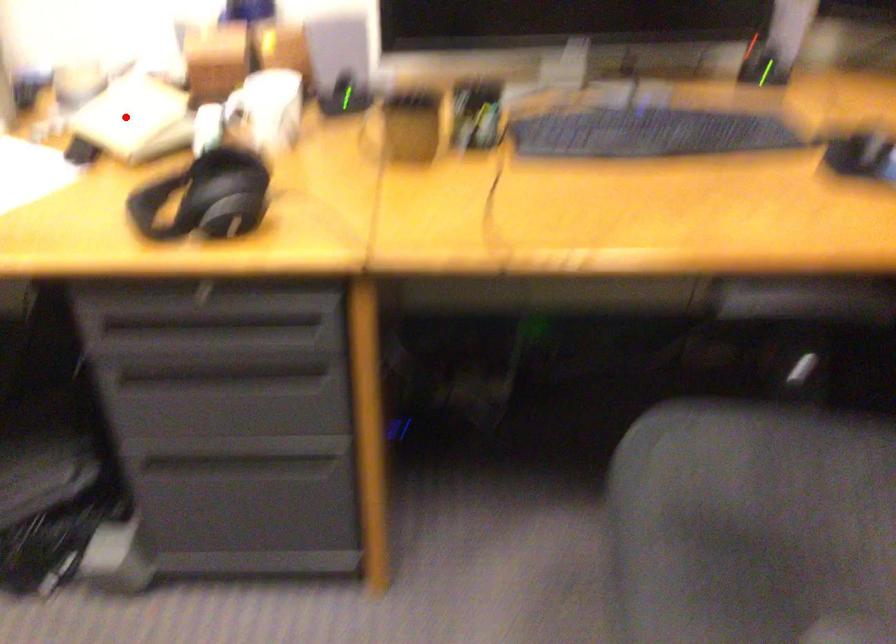
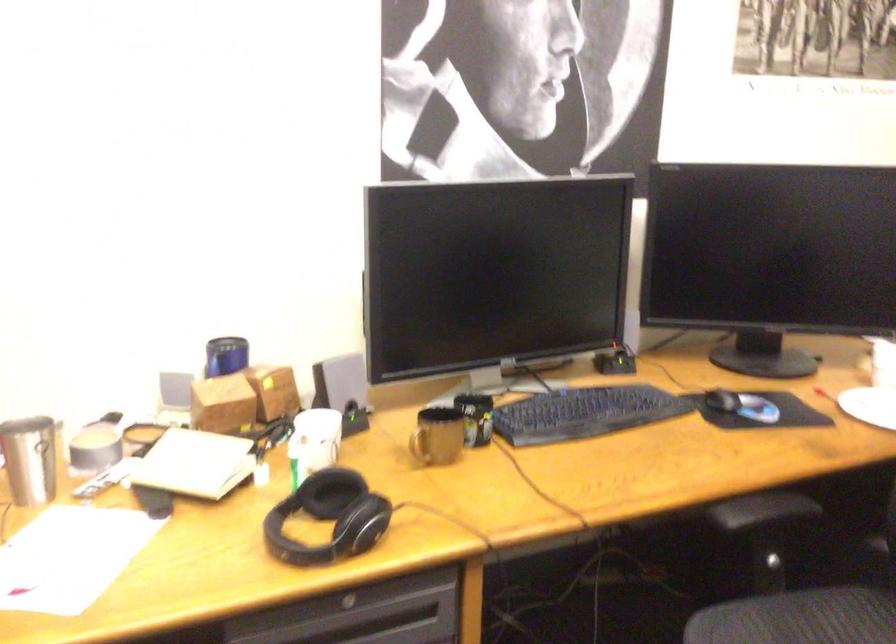
Question: I am providing you with two images of the same scene from different viewpoints. A red point is shown in image1. For the corresponding object point in image2, is it positioned nearer or farther from the camera?

Choices:
 (A) Nearer
 (B) Farther

Answer: (B)